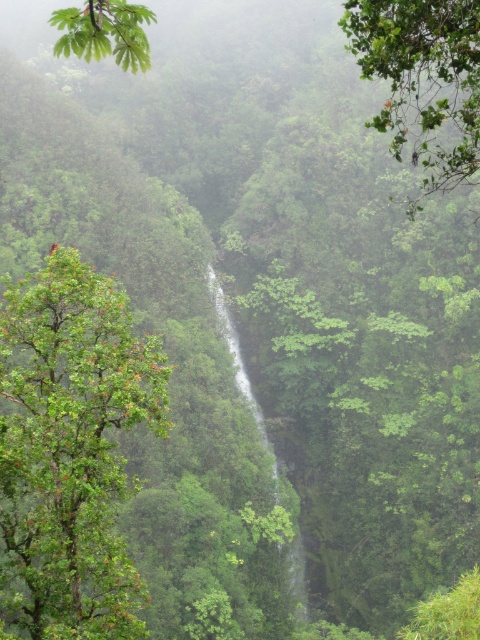
Does green leafy tree at left appear on the right side of green leafy tree at upper left?

Incorrect, green leafy tree at left is not on the right side of green leafy tree at upper left.

The height and width of the screenshot is (640, 480). Find the location of `green leafy tree at left`. green leafy tree at left is located at coordinates (71, 449).

In the scene shown: Is green leafy tree at upper center positioned at the back of green leafy tree at upper left?

Yes, it is behind green leafy tree at upper left.

Is green leafy tree at upper center to the left of green leafy tree at upper left from the viewer's perspective?

No, green leafy tree at upper center is not to the left of green leafy tree at upper left.

Which is in front, point (444, 22) or point (120, 60)?

Point (120, 60) is in front.

Locate an element on the screen. green leafy tree at upper center is located at coordinates (422, 77).

Consider the image. Who is shorter, green leafy tree at left or green leafy tree at upper center?

Standing shorter between the two is green leafy tree at left.

From the picture: Measure the distance between green leafy tree at left and camera.

They are 14.01 meters apart.

The image size is (480, 640). What do you see at coordinates (71, 449) in the screenshot? I see `green leafy tree at left` at bounding box center [71, 449].

Identify the location of green leafy tree at left. Image resolution: width=480 pixels, height=640 pixels. (71, 449).